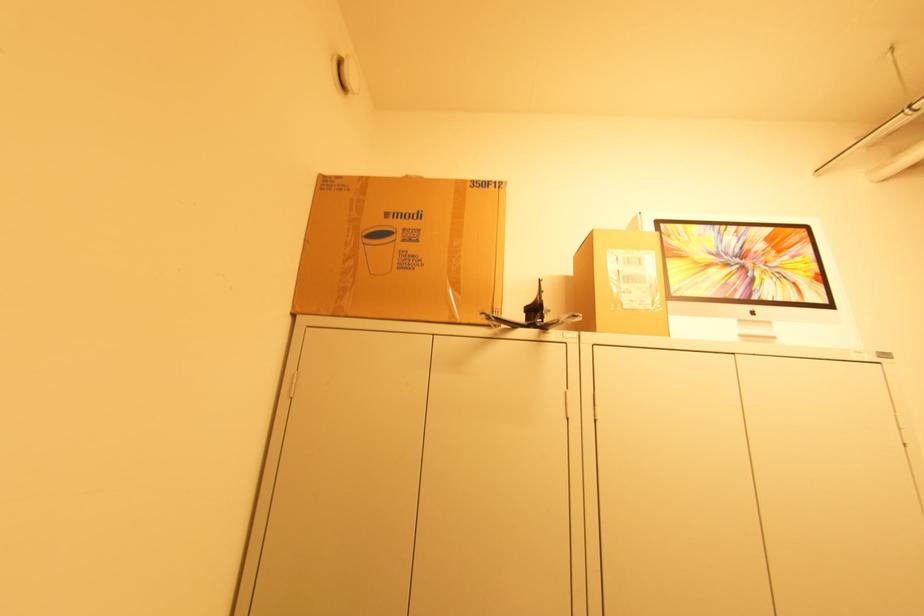
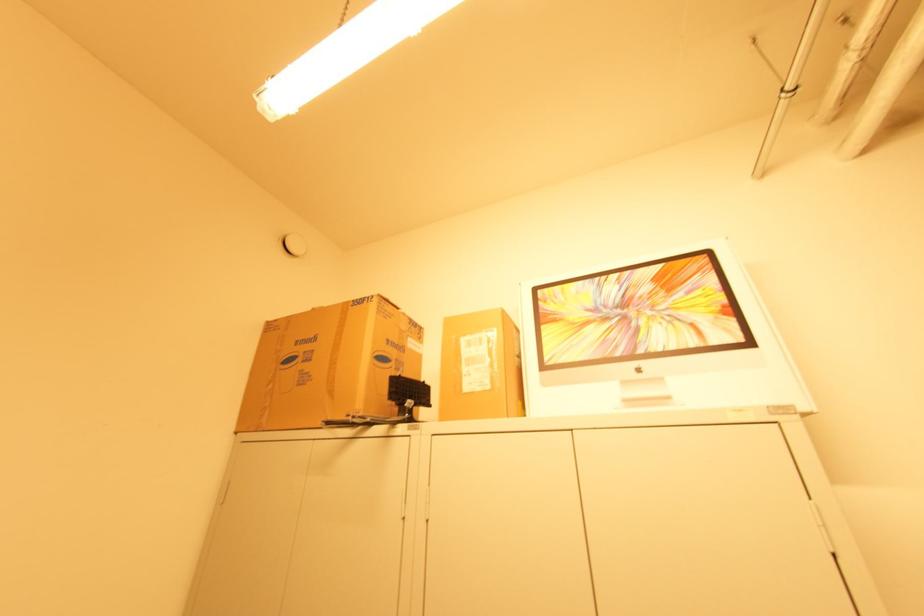
In the second image, find the point that corresponds to [745,260] in the first image.

(625, 310)